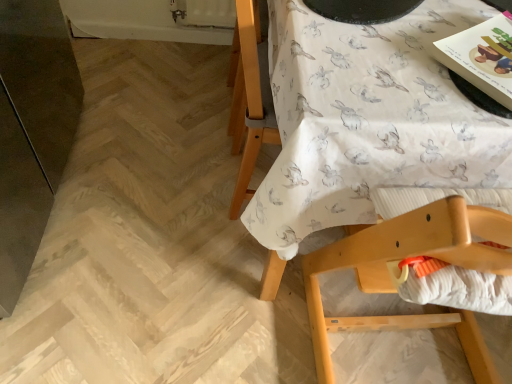
Question: Is white fabric with rabbit print at upper right bigger or smaller than white textured fabric at lower right?

Choices:
 (A) small
 (B) big

Answer: (B)

Question: Is white fabric with rabbit print at upper right taller or shorter than white textured fabric at lower right?

Choices:
 (A) short
 (B) tall

Answer: (B)

Question: Which is farther from the white textured fabric at lower right?

Choices:
 (A) white fabric with rabbit print at upper right
 (B) matte paper magazine at upper right
 (C) wooden highchair at upper right

Answer: (B)

Question: Based on their relative distances, which object is farther from the white textured fabric at lower right?

Choices:
 (A) matte paper magazine at upper right
 (B) wooden highchair at upper right
 (C) white fabric with rabbit print at upper right

Answer: (A)